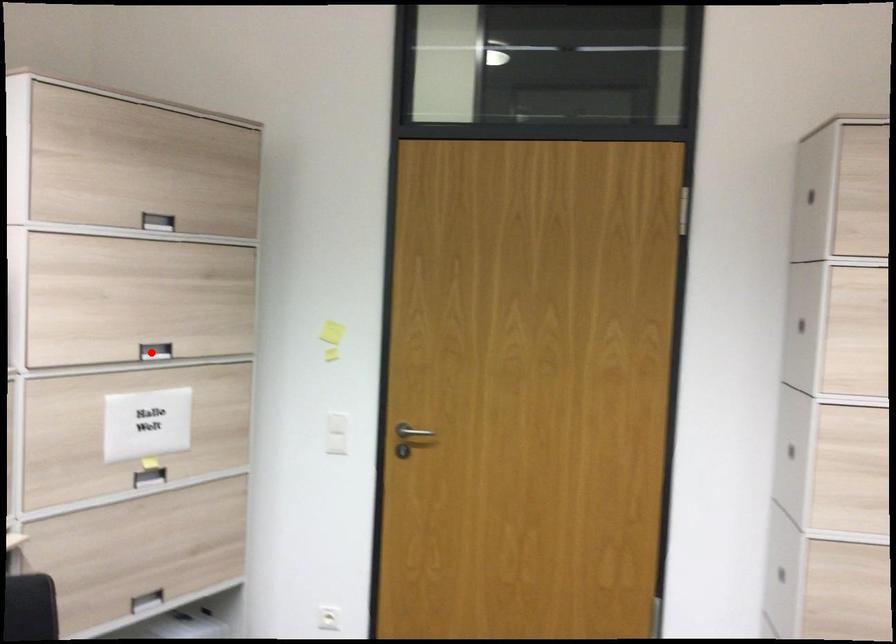
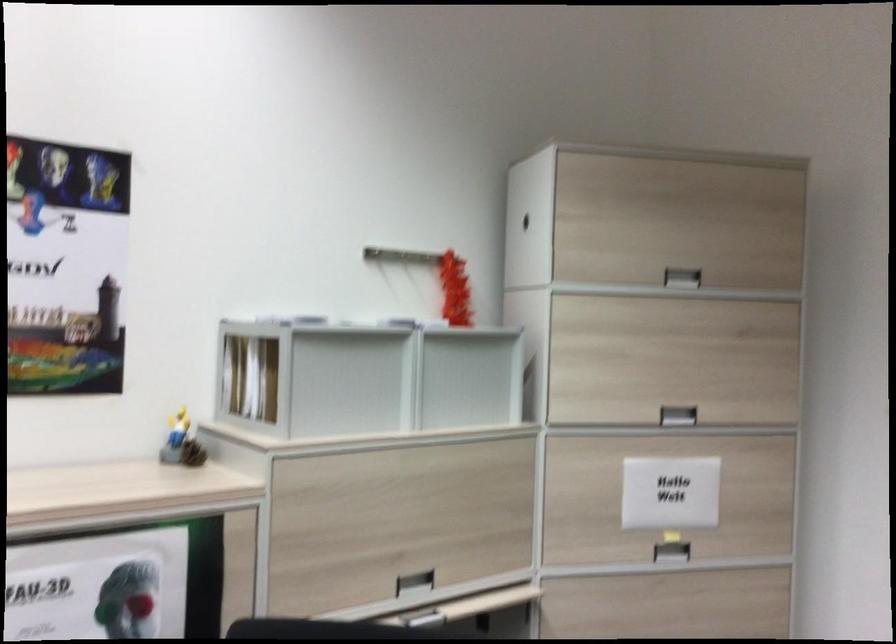
Find the pixel in the second image that matches the highlighted location in the first image.

(677, 415)